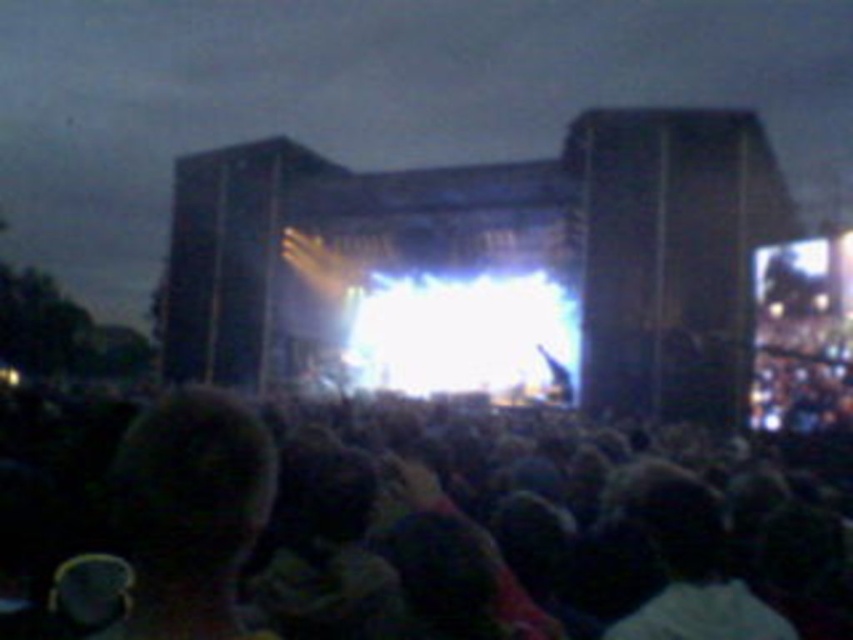
You are a photographer at the concert and want to capture a photo that includes both the dark matte crowd at center and the dark hair at lower left. Which object should you focus on first to ensure both are in frame?

You should focus on the dark matte crowd at center first because it is larger than the dark hair at lower left, ensuring it fits within the frame while still capturing the smaller object.

You are a photographer at the concert. You want to capture a photo of the dark matte crowd at center without the dark hair at lower left blocking the view. Is this possible?

The dark matte crowd at center is positioned under the dark hair at lower left, so the dark hair at lower left would block the view of the dark matte crowd at center. Therefore, capturing a clear photo of the dark matte crowd at center without obstruction from the dark hair at lower left is not possible.

You are a photographer standing at the edge of the stage during a nighttime concert. You want to capture a photo of the dark matte crowd at center without including the stage lights in the background. Since you are 7.78 meters away from the crowd, what should you adjust in your camera settings to ensure the crowd is in focus and the lights are blurred?

To ensure the dark matte crowd at center is in focus while blurring the stage lights, you should use a narrow aperture setting to increase depth of field and a slow shutter speed to create motion blur on the moving lights. However, since the crowd is 7.78 meters away, you must also adjust your focus point precisely on the crowd and possibly use a tripod to stabilize the camera during the longer exposure.